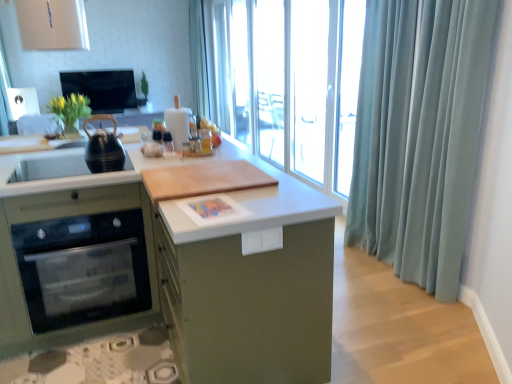
Question: From the image's perspective, is satin blue curtain at right, which appears as the 1th shower curtain when ordered from the bottom, located above or below light blue fabric at upper center, acting as the first shower curtain starting from the top?

Choices:
 (A) above
 (B) below

Answer: (B)

Question: From a real-world perspective, relative to light blue fabric at upper center, acting as the first shower curtain starting from the top, is satin blue curtain at right, acting as the 1th shower curtain starting from the front, vertically above or below?

Choices:
 (A) above
 (B) below

Answer: (B)

Question: Considering the real-world distances, which object is farthest from the black matte kettle at left?

Choices:
 (A) light blue fabric at upper center, acting as the second shower curtain starting from the bottom
 (B) wooden cutting board at center
 (C) white matte drawer at center
 (D) satin blue curtain at right, which appears as the 1th shower curtain when ordered from the bottom
 (E) matte black oven at left

Answer: (A)

Question: Considering the real-world distances, which object is farthest from the matte black oven at left?

Choices:
 (A) white matte drawer at center
 (B) light blue fabric at upper center, acting as the first shower curtain starting from the top
 (C) wooden cutting board at center
 (D) satin blue curtain at right, acting as the 1th shower curtain starting from the front
 (E) white glossy sink at left

Answer: (B)